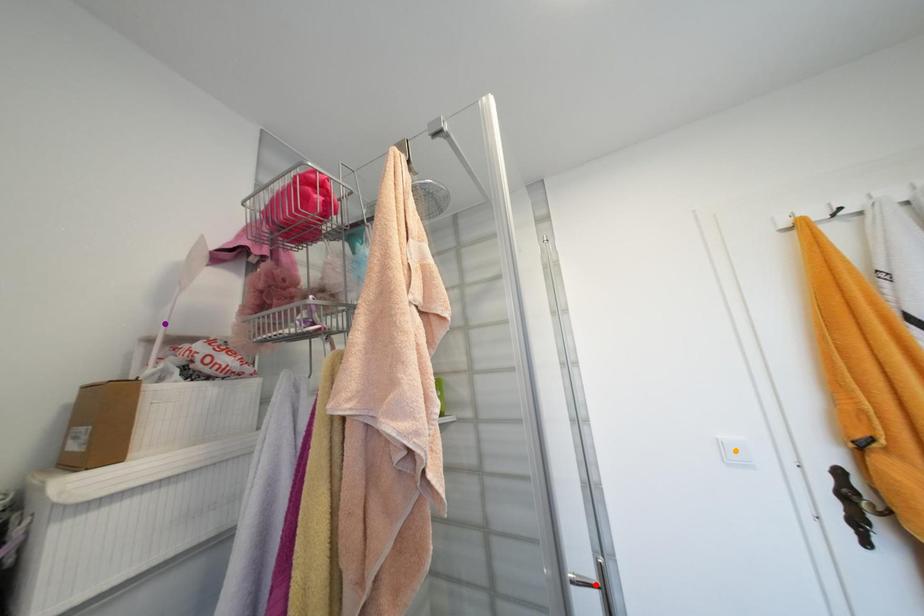
Order these from nearest to farthest:
1. purple point
2. red point
3. orange point

red point
purple point
orange point